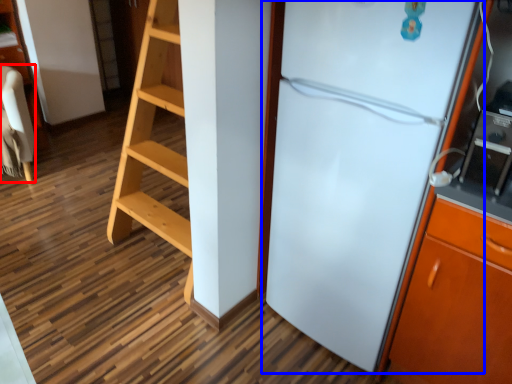
Question: Which point is closer to the camera, furniture (highlighted by a red box) or refrigerator (highlighted by a blue box)?

Choices:
 (A) furniture
 (B) refrigerator

Answer: (B)